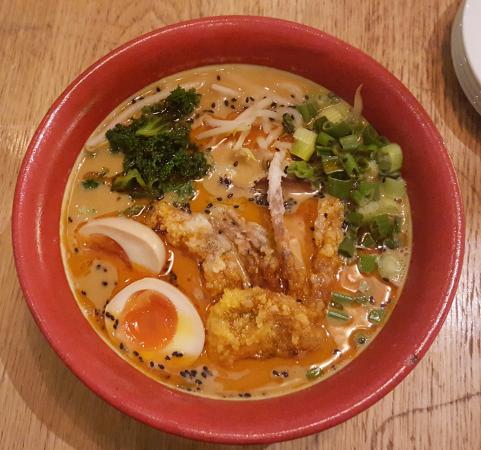
You are a GUI agent. You are given a task and a screenshot of the screen. Output one action in this format:
    pyautogui.click(x=<x>, y=<y>)
    Task: Click on the space left of bowl
    The width and height of the screenshot is (481, 450).
    Given the screenshot: What is the action you would take?
    pyautogui.click(x=6, y=239)